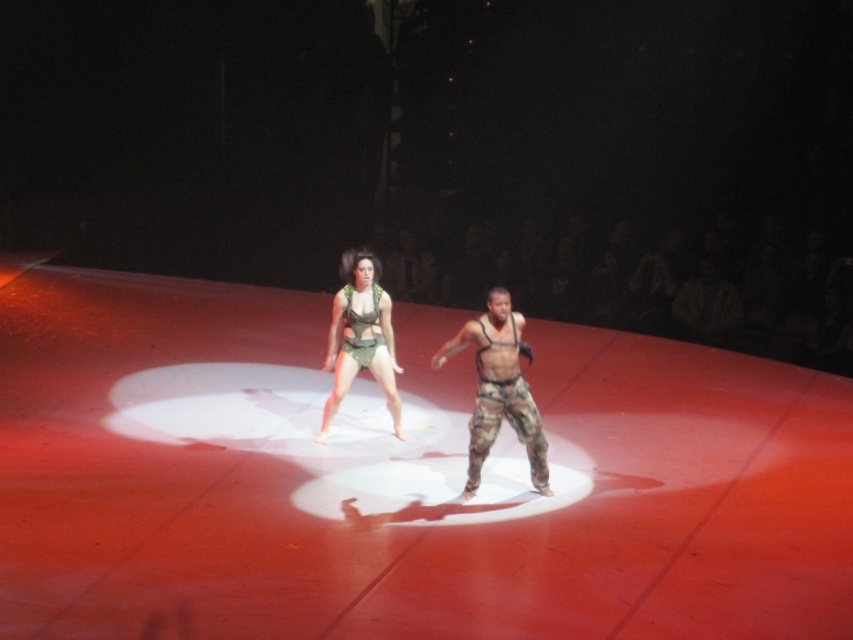
Looking at this image, you are a stagehand trying to place a spotlight on the stage. You have two points marked as potential locations for the spotlight. The first point is at coordinates point [480,349] and the second is at point [338,364]. From the audience perspective, which point is closer to the front of the stage?

Point [480,349] is in front of point [338,364], so the spotlight placed at point [480,349] would be closer to the front of the stage from the audience perspective.

You are a stagehand setting up a spotlight for the performers. The spotlight can only illuminate objects up to 1 meter in height. Given the camouflage pants at center and the green fabric harness at center, which one will the spotlight definitely cover?

The camouflage pants at center has a lesser height compared to green fabric harness at center. Since the spotlight can only illuminate objects up to 1 meter in height, both items might be within the limit. However, the camouflage pants at center is shorter, so it will definitely be fully covered by the spotlight if the green fabric harness at center is also under 1 meter. If the harness exceeds the limit, only the pants would be fully covered. Without exact measurements, we can only confirm the camouflage.

You are a photographer standing at the back of the theater. You want to take a closeup photo of the camouflage pants at center and the green fabric harness at center. Which one will appear larger in your photo?

The camouflage pants at center will appear larger in the photo because it is closer to the viewer than the green fabric harness at center.